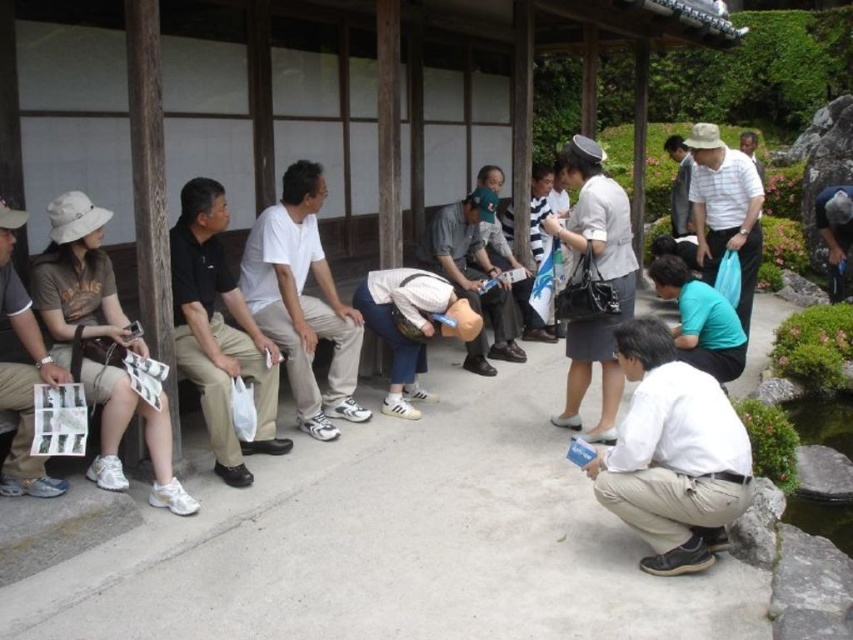
You are a tour guide leading a group to the entrance of the building. You see the white matte cap at center and the brown leather mannequin at center. Which object is closer to the entrance?

The white matte cap at center is closer to the entrance because it is in front of the brown leather mannequin at center, indicating it is nearer to the entrance.